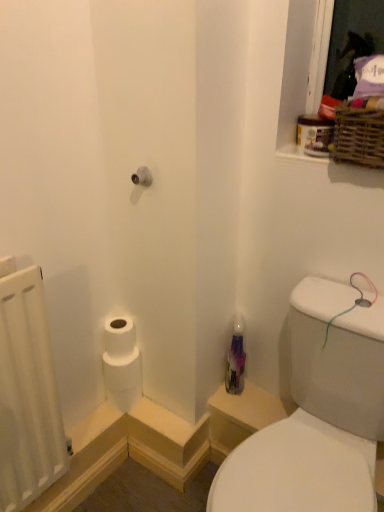
Question: Does transparent plastic bottle at lower right touch woven brown basket at upper right?

Choices:
 (A) yes
 (B) no

Answer: (B)

Question: Considering the relative positions of transparent plastic bottle at lower right and woven brown basket at upper right in the image provided, is transparent plastic bottle at lower right in front of woven brown basket at upper right?

Choices:
 (A) no
 (B) yes

Answer: (B)

Question: From a real-world perspective, is transparent plastic bottle at lower right physically below woven brown basket at upper right?

Choices:
 (A) yes
 (B) no

Answer: (A)

Question: Does transparent plastic bottle at lower right have a larger size compared to woven brown basket at upper right?

Choices:
 (A) yes
 (B) no

Answer: (A)

Question: Is woven brown basket at upper right located within transparent plastic bottle at lower right?

Choices:
 (A) no
 (B) yes

Answer: (A)

Question: Is white matte toilet paper at lower left wider or thinner than woven brown basket at upper right?

Choices:
 (A) wide
 (B) thin

Answer: (B)

Question: Would you say white matte toilet paper at lower left is to the left or to the right of woven brown basket at upper right in the picture?

Choices:
 (A) right
 (B) left

Answer: (B)

Question: Does point (112, 398) appear closer or farther from the camera than point (370, 117)?

Choices:
 (A) closer
 (B) farther

Answer: (B)

Question: Considering their positions, is white matte toilet paper at lower left located in front of or behind woven brown basket at upper right?

Choices:
 (A) behind
 (B) front

Answer: (A)

Question: Is translucent purple bottle at center in front of or behind woven brown basket at upper right in the image?

Choices:
 (A) front
 (B) behind

Answer: (B)

Question: Would you say translucent purple bottle at center is inside or outside woven brown basket at upper right?

Choices:
 (A) outside
 (B) inside

Answer: (A)

Question: In the image, is translucent purple bottle at center on the left side or the right side of woven brown basket at upper right?

Choices:
 (A) right
 (B) left

Answer: (B)

Question: From a real-world perspective, is translucent purple bottle at center physically located above or below woven brown basket at upper right?

Choices:
 (A) below
 (B) above

Answer: (A)

Question: Considering the positions of point (24, 393) and point (228, 360), is point (24, 393) closer or farther from the camera than point (228, 360)?

Choices:
 (A) closer
 (B) farther

Answer: (A)

Question: Is white matte radiator at left wider or thinner than translucent purple bottle at center?

Choices:
 (A) thin
 (B) wide

Answer: (B)